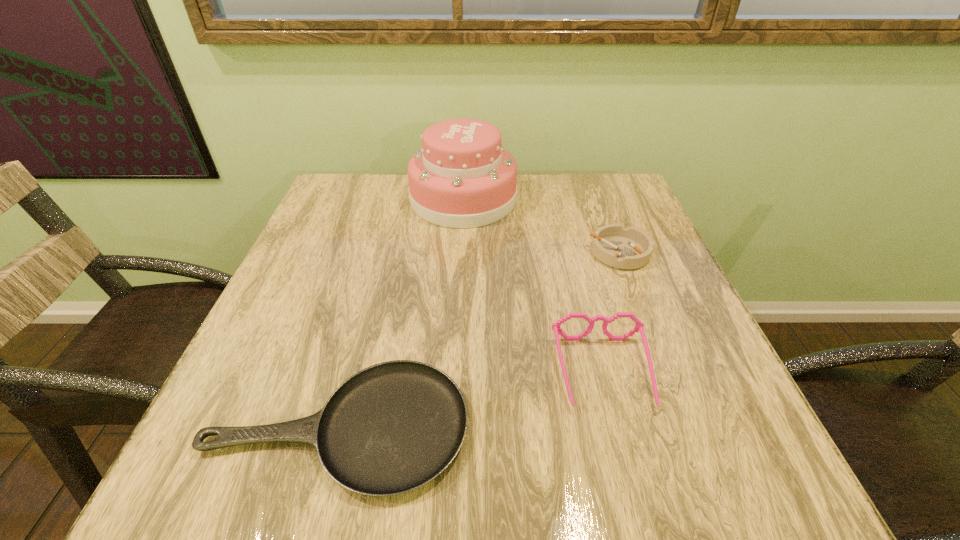
Locate an element on the screen. The image size is (960, 540). cake is located at coordinates 463,177.

Where is `the farthest object`? The image size is (960, 540). the farthest object is located at coordinates (463, 177).

Locate an element on the screen. This screenshot has height=540, width=960. the second tallest object is located at coordinates (639, 326).

You are a GUI agent. You are given a task and a screenshot of the screen. Output one action in this format:
    pyautogui.click(x=<x>, y=<y>)
    Task: Click on the third tallest object
    The image size is (960, 540).
    Given the screenshot: What is the action you would take?
    pyautogui.click(x=625, y=248)

Image resolution: width=960 pixels, height=540 pixels. Find the location of `ashtray`. ashtray is located at coordinates pyautogui.click(x=625, y=248).

I want to click on the shortest object, so click(x=391, y=428).

The width and height of the screenshot is (960, 540). I want to click on free space located 0.050m on the left of the cake, so click(x=392, y=199).

Find the location of `free space located 0.060m on the arms of the third shortest object`. free space located 0.060m on the arms of the third shortest object is located at coordinates (623, 449).

Where is `vacant space located on the back of the third tallest object`? Image resolution: width=960 pixels, height=540 pixels. vacant space located on the back of the third tallest object is located at coordinates (597, 197).

Identify the location of vacant space located on the back of the shortest object. (373, 294).